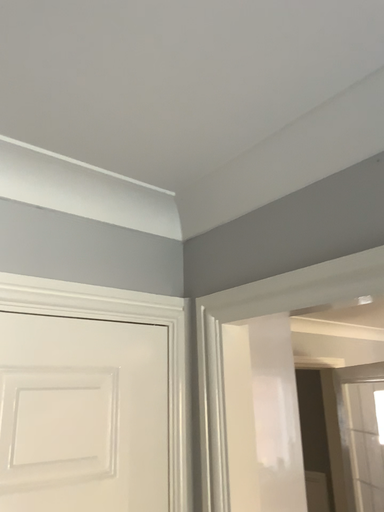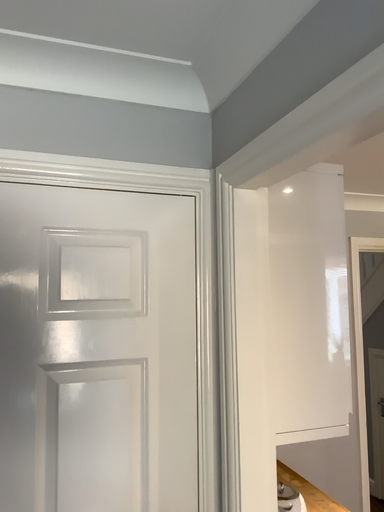
Question: Which way did the camera rotate in the video?

Choices:
 (A) rotated downward
 (B) rotated upward

Answer: (A)